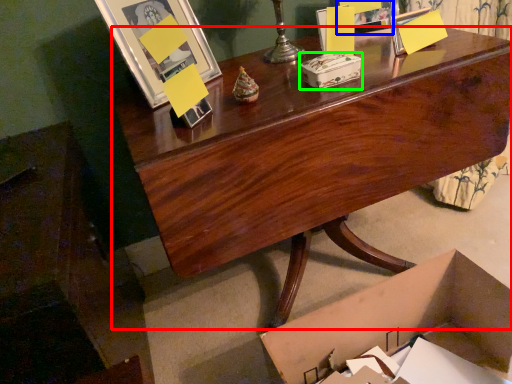
Question: Which object is positioned farthest from desk (highlighted by a red box)? Select from picture frame (highlighted by a blue box) and box (highlighted by a green box).

Choices:
 (A) picture frame
 (B) box

Answer: (A)